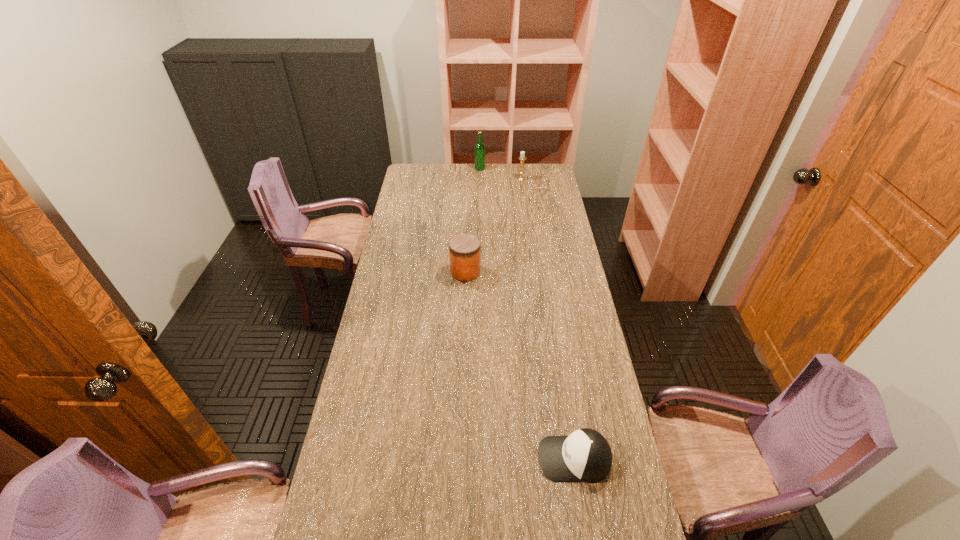
Locate an element on the screen. This screenshot has width=960, height=540. free spot at the far right corner of the desktop is located at coordinates (533, 174).

Where is `free space between the cap and the jar`? The width and height of the screenshot is (960, 540). free space between the cap and the jar is located at coordinates (520, 365).

Locate an element on the screen. This screenshot has width=960, height=540. free space between the candle holder and the cap is located at coordinates (548, 319).

The width and height of the screenshot is (960, 540). Identify the location of free space that is in between the jar and the farthest object. (472, 220).

This screenshot has width=960, height=540. I want to click on vacant area that lies between the third farthest object and the second farthest object, so click(493, 225).

I want to click on free spot between the beer bottle and the cap, so click(527, 313).

Locate an element on the screen. vacant space that's between the nearest object and the jar is located at coordinates (520, 365).

Find the location of a particular element. The image size is (960, 540). empty space that is in between the farthest object and the nearest object is located at coordinates (527, 313).

In order to click on vacant space that is in between the second nearest object and the third nearest object in this screenshot , I will do tap(493, 225).

The image size is (960, 540). I want to click on free space between the nearest object and the tallest object, so (x=527, y=313).